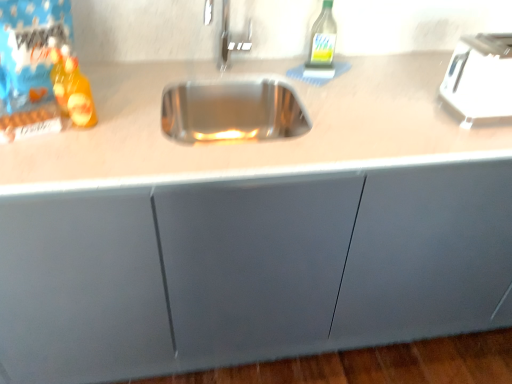
This screenshot has width=512, height=384. I want to click on vacant point to the right of translucent plastic bottle at left, which is the 1th bottle from left to right, so click(x=133, y=130).